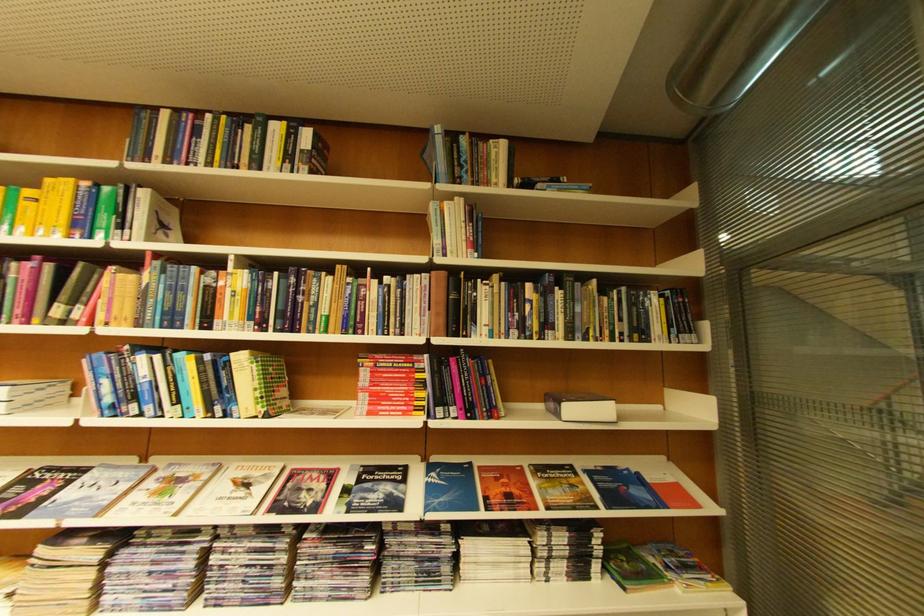
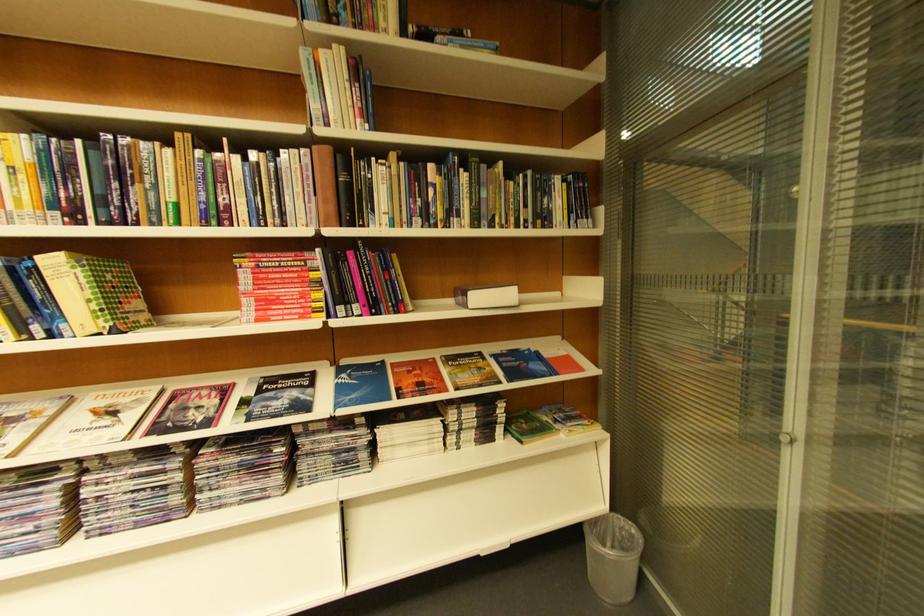
In the second image, find the point that corresponds to point 396,363 in the first image.

(281, 262)